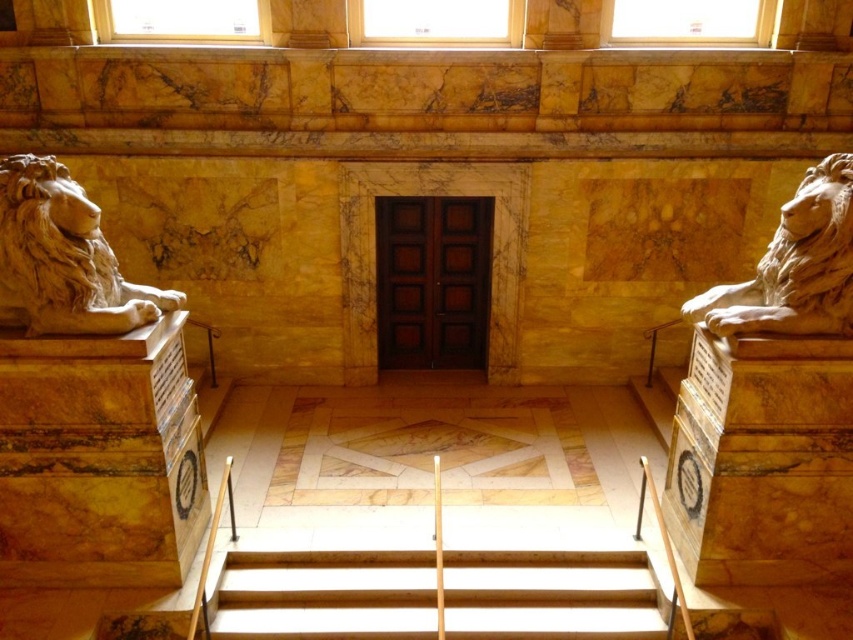
Can you confirm if white marble lion at left is positioned below white marble lion at right?

Indeed, white marble lion at left is positioned under white marble lion at right.

Between point (41, 182) and point (821, 326), which one is positioned behind?

The point (821, 326) is behind.

What do you see at coordinates (62, 259) in the screenshot? I see `white marble lion at left` at bounding box center [62, 259].

Identify the location of white marble lion at left. (62, 259).

Can you confirm if wooden stairs at center is shorter than white marble lion at left?

Yes.

Which is above, wooden stairs at center or white marble lion at left?

white marble lion at left

Does point (312, 609) come behind point (74, 262)?

Yes, it is.

At what (x,y) coordinates should I click in order to perform the action: click on wooden stairs at center. Please return your answer as a coordinate pair (x, y). The width and height of the screenshot is (853, 640). Looking at the image, I should click on (325, 595).

Is wooden stairs at center thinner than white marble lion at right?

No, wooden stairs at center is not thinner than white marble lion at right.

Does wooden stairs at center appear under white marble lion at right?

Correct, wooden stairs at center is located below white marble lion at right.

Which is behind, point (300, 611) or point (846, 248)?

The point (300, 611) is more distant.

At what (x,y) coordinates should I click in order to perform the action: click on wooden stairs at center. Please return your answer as a coordinate pair (x, y). This screenshot has height=640, width=853. Looking at the image, I should click on point(325,595).